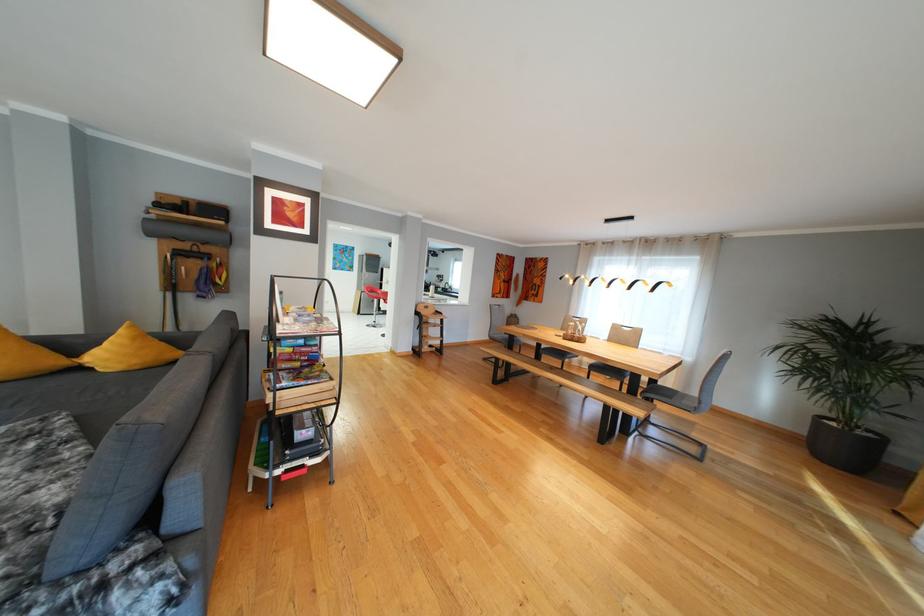
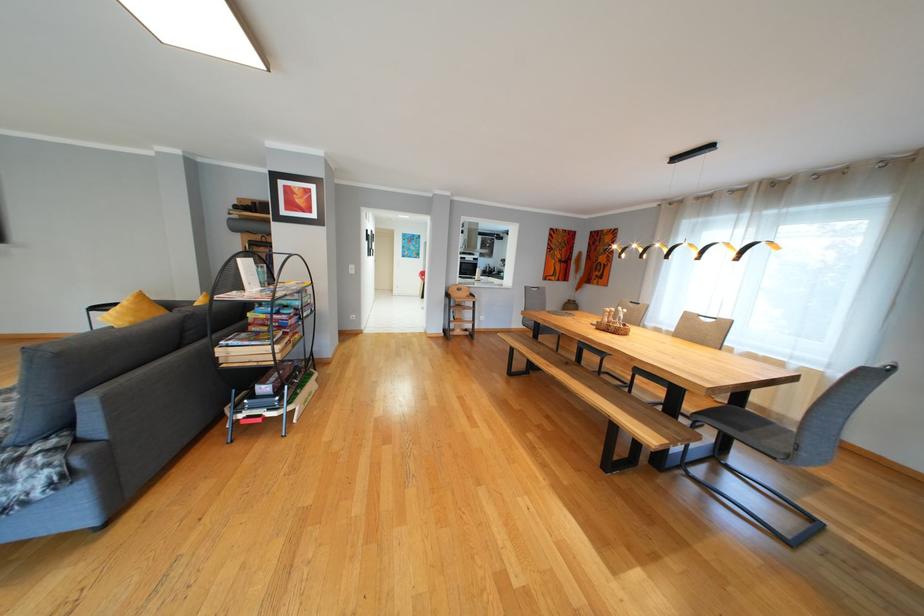
In a continuous first-person perspective shot, in which direction is the camera moving?

The cameraman moved toward right, forward.